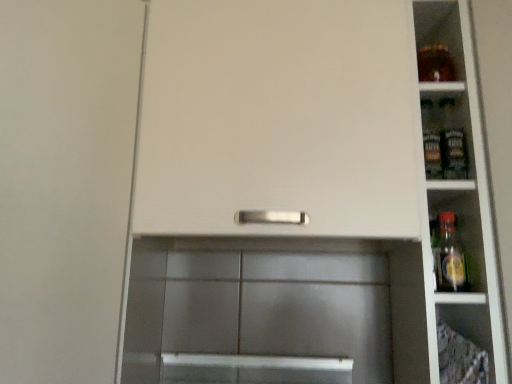
Question: From the image's perspective, is white glossy shelves at right below white matte cabinet door at center?

Choices:
 (A) yes
 (B) no

Answer: (B)

Question: Is white glossy shelves at right not close to white matte cabinet door at center?

Choices:
 (A) no
 (B) yes

Answer: (A)

Question: Is white glossy shelves at right taller than white matte cabinet door at center?

Choices:
 (A) yes
 (B) no

Answer: (B)

Question: From a real-world perspective, is white glossy shelves at right located higher than white matte cabinet door at center?

Choices:
 (A) yes
 (B) no

Answer: (A)

Question: Does white glossy shelves at right have a greater width compared to white matte cabinet door at center?

Choices:
 (A) yes
 (B) no

Answer: (B)

Question: Is white glossy shelves at right shorter than white matte cabinet door at center?

Choices:
 (A) yes
 (B) no

Answer: (A)

Question: Is white matte cabinet door at center not inside white glossy shelves at right?

Choices:
 (A) yes
 (B) no

Answer: (A)

Question: Considering the relative sizes of white matte cabinet door at center and white glossy shelves at right in the image provided, is white matte cabinet door at center thinner than white glossy shelves at right?

Choices:
 (A) yes
 (B) no

Answer: (B)

Question: Is white matte cabinet door at center to the left of white glossy shelves at right from the viewer's perspective?

Choices:
 (A) yes
 (B) no

Answer: (A)

Question: Could white glossy shelves at right be considered to be inside white matte cabinet door at center?

Choices:
 (A) yes
 (B) no

Answer: (B)

Question: From a real-world perspective, is white matte cabinet door at center over white glossy shelves at right?

Choices:
 (A) no
 (B) yes

Answer: (A)

Question: Is white matte cabinet door at center next to white glossy shelves at right?

Choices:
 (A) yes
 (B) no

Answer: (B)

Question: From a real-world perspective, is white matte cabinet door at center physically located above or below white glossy shelves at right?

Choices:
 (A) above
 (B) below

Answer: (B)